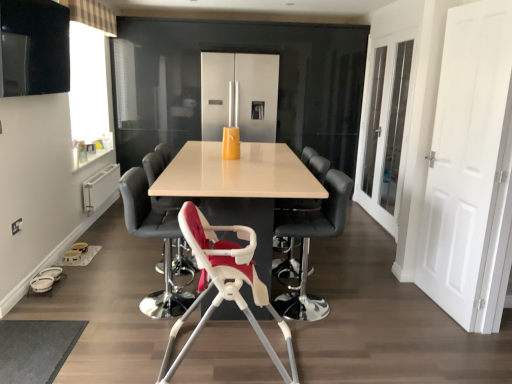
You are a GUI agent. You are given a task and a screenshot of the screen. Output one action in this format:
    pyautogui.click(x=<x>, y=<y>)
    Task: Click on the free space that is to the left of matte black chair at center, which appears as the fourth chair when viewed from the front
    Image resolution: width=512 pixels, height=384 pixels.
    Given the screenshot: What is the action you would take?
    pyautogui.click(x=125, y=266)